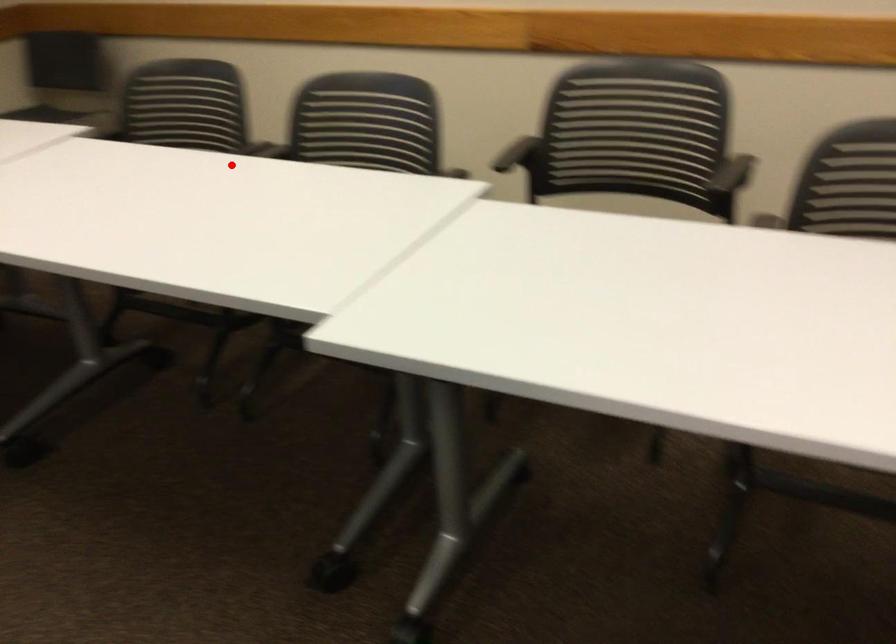
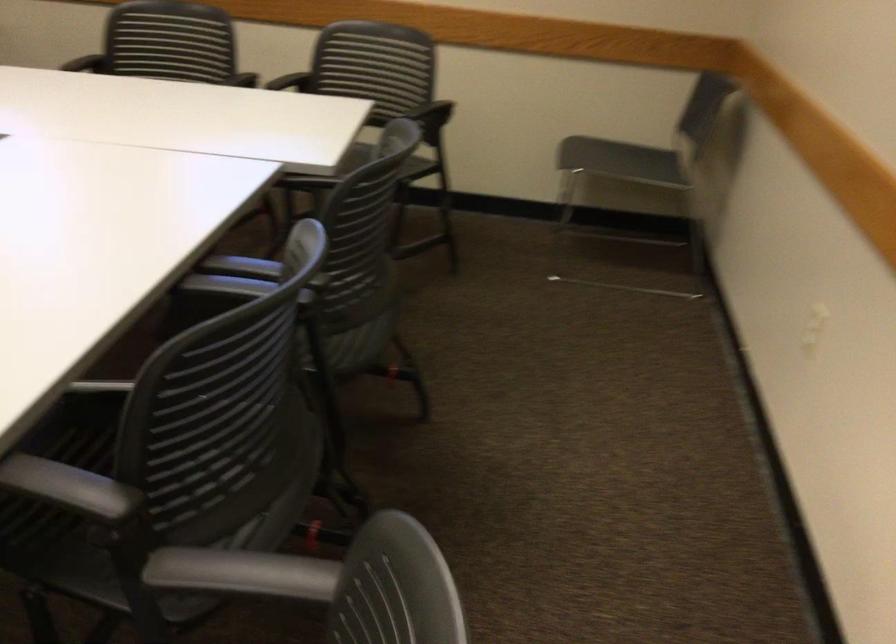
The point at the highlighted location is marked in the first image. Where is the corresponding point in the second image?

(246, 274)